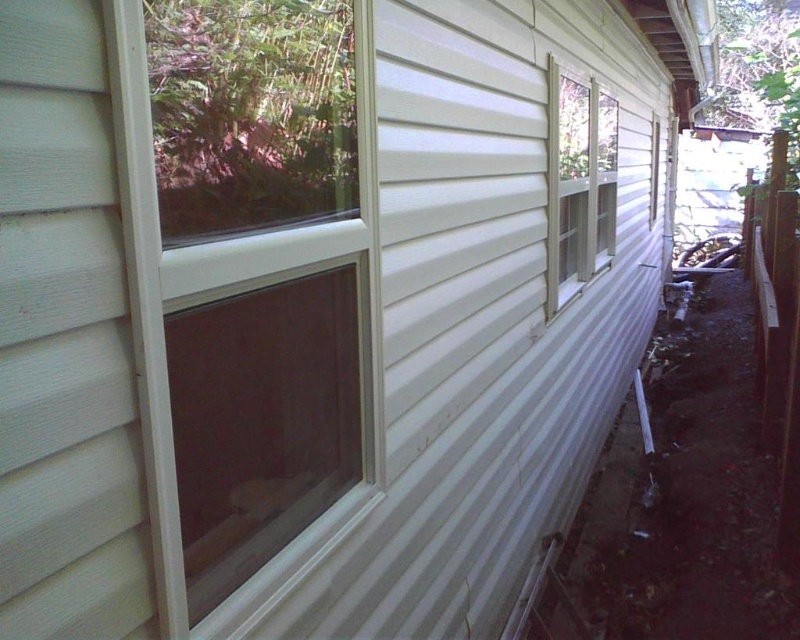
You are standing in front of the house and want to clean the clear glass window at center and the clear glass window at upper right. Which window should you clean first if you want to start from the lower one?

You should clean the clear glass window at center first because it is located below the clear glass window at upper right.